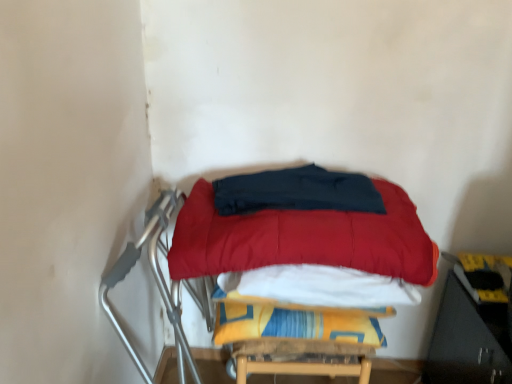
Question: Considering the relative sizes of dark blue fabric at center, the first blanket when ordered from top to bottom, and yellow fabric blanket at center, marked as the first blanket in a bottom-to-top arrangement, in the image provided, is dark blue fabric at center, the first blanket when ordered from top to bottom, taller than yellow fabric blanket at center, marked as the first blanket in a bottom-to-top arrangement,?

Choices:
 (A) no
 (B) yes

Answer: (A)

Question: From a real-world perspective, is dark blue fabric at center, placed as the 2th blanket when sorted from bottom to top, located beneath yellow fabric blanket at center, the 2th blanket when ordered from top to bottom?

Choices:
 (A) no
 (B) yes

Answer: (A)

Question: From the image's perspective, is dark blue fabric at center, placed as the 2th blanket when sorted from bottom to top, beneath yellow fabric blanket at center, the 2th blanket when ordered from top to bottom?

Choices:
 (A) yes
 (B) no

Answer: (B)

Question: Is dark blue fabric at center, placed as the 2th blanket when sorted from bottom to top, smaller than yellow fabric blanket at center, the 2th blanket when ordered from top to bottom?

Choices:
 (A) no
 (B) yes

Answer: (B)

Question: Can yellow fabric blanket at center, the 2th blanket when ordered from top to bottom, be found inside dark blue fabric at center, the first blanket when ordered from top to bottom?

Choices:
 (A) no
 (B) yes

Answer: (A)

Question: Is the position of dark blue fabric at center, placed as the 2th blanket when sorted from bottom to top, less distant than that of yellow fabric blanket at center, marked as the first blanket in a bottom-to-top arrangement?

Choices:
 (A) no
 (B) yes

Answer: (B)

Question: Is velvet red mattress at center oriented away from dark blue fabric at center, the first blanket when ordered from top to bottom?

Choices:
 (A) yes
 (B) no

Answer: (B)

Question: From a real-world perspective, is velvet red mattress at center located higher than dark blue fabric at center, placed as the 2th blanket when sorted from bottom to top?

Choices:
 (A) no
 (B) yes

Answer: (A)

Question: Is dark blue fabric at center, placed as the 2th blanket when sorted from bottom to top, a part of velvet red mattress at center?

Choices:
 (A) yes
 (B) no

Answer: (A)

Question: Is velvet red mattress at center at the left side of dark blue fabric at center, placed as the 2th blanket when sorted from bottom to top?

Choices:
 (A) no
 (B) yes

Answer: (A)

Question: From the image's perspective, is velvet red mattress at center above dark blue fabric at center, the first blanket when ordered from top to bottom?

Choices:
 (A) yes
 (B) no

Answer: (B)

Question: Considering the relative sizes of velvet red mattress at center and dark blue fabric at center, placed as the 2th blanket when sorted from bottom to top, in the image provided, is velvet red mattress at center wider than dark blue fabric at center, placed as the 2th blanket when sorted from bottom to top,?

Choices:
 (A) yes
 (B) no

Answer: (A)

Question: From the image's perspective, would you say yellow fabric blanket at center, marked as the first blanket in a bottom-to-top arrangement, is positioned over velvet red mattress at center?

Choices:
 (A) yes
 (B) no

Answer: (B)